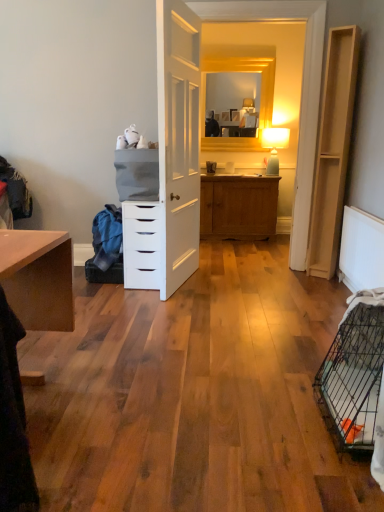
Question: Does blue fabric at left lie in front of white matte chest of drawers at center?

Choices:
 (A) no
 (B) yes

Answer: (A)

Question: Can you confirm if blue fabric at left is shorter than white matte chest of drawers at center?

Choices:
 (A) yes
 (B) no

Answer: (A)

Question: Can you confirm if blue fabric at left is smaller than white matte chest of drawers at center?

Choices:
 (A) yes
 (B) no

Answer: (A)

Question: Is blue fabric at left wider than white matte chest of drawers at center?

Choices:
 (A) yes
 (B) no

Answer: (B)

Question: Is blue fabric at left touching white matte chest of drawers at center?

Choices:
 (A) yes
 (B) no

Answer: (B)

Question: In terms of width, does white matte chest of drawers at center look wider or thinner when compared to light wood/file cabinet at right?

Choices:
 (A) thin
 (B) wide

Answer: (B)

Question: Which is correct: white matte chest of drawers at center is inside light wood/file cabinet at right, or outside of it?

Choices:
 (A) outside
 (B) inside

Answer: (A)

Question: From their relative heights in the image, would you say white matte chest of drawers at center is taller or shorter than light wood/file cabinet at right?

Choices:
 (A) short
 (B) tall

Answer: (A)

Question: Does point (142, 202) appear closer or farther from the camera than point (332, 123)?

Choices:
 (A) closer
 (B) farther

Answer: (A)

Question: Is light wood/file cabinet at right situated inside blue fabric at left or outside?

Choices:
 (A) inside
 (B) outside

Answer: (B)

Question: From a real-world perspective, is light wood/file cabinet at right physically located above or below blue fabric at left?

Choices:
 (A) above
 (B) below

Answer: (A)

Question: Is light wood/file cabinet at right in front of or behind blue fabric at left in the image?

Choices:
 (A) front
 (B) behind

Answer: (A)

Question: Looking at the image, does light wood/file cabinet at right seem bigger or smaller compared to blue fabric at left?

Choices:
 (A) small
 (B) big

Answer: (B)

Question: Is white textured radiator at lower right in front of or behind white matte chest of drawers at center in the image?

Choices:
 (A) front
 (B) behind

Answer: (A)

Question: In terms of size, does white textured radiator at lower right appear bigger or smaller than white matte chest of drawers at center?

Choices:
 (A) big
 (B) small

Answer: (B)